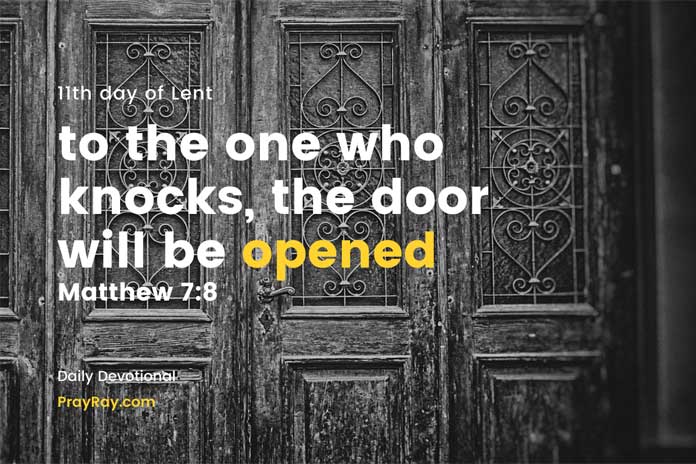
This screenshot has height=464, width=696. Find the location of `right panel`. right panel is located at coordinates (532, 227).